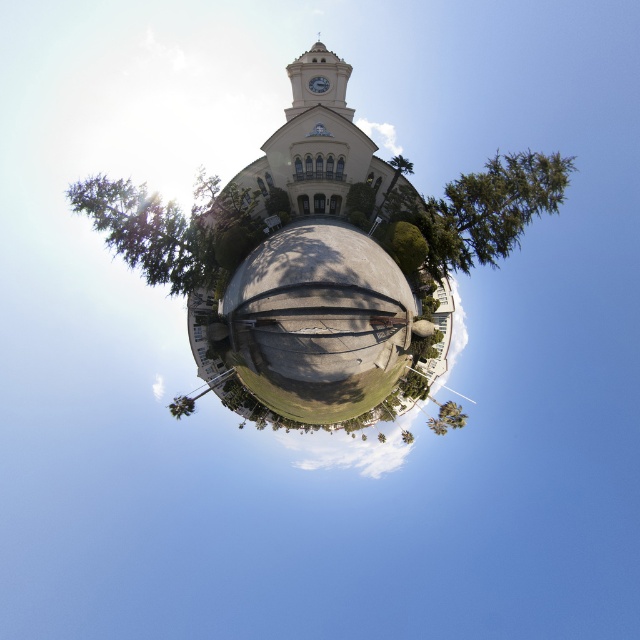
How distant is green textured tree at upper center from green leafy tree at center?

green textured tree at upper center and green leafy tree at center are 34.64 meters apart.

Which is more to the left, green textured tree at upper center or green leafy tree at center?

green leafy tree at center

In order to click on green textured tree at upper center in this screenshot , I will do (490, 209).

Who is higher up, green leafy tree at lower center or green leafy tree at center?

Positioned higher is green leafy tree at lower center.

Does green leafy tree at lower center have a lesser width compared to green leafy tree at center?

No, green leafy tree at lower center is not thinner than green leafy tree at center.

This screenshot has height=640, width=640. What are the coordinates of `green leafy tree at lower center` in the screenshot? It's located at (448, 417).

Locate an element on the screen. The width and height of the screenshot is (640, 640). green leafy tree at lower center is located at coordinates [448, 417].

Is green leafy tree at upper center shorter than green leafy tree at lower left?

No, green leafy tree at upper center is not shorter than green leafy tree at lower left.

What do you see at coordinates (172, 228) in the screenshot? I see `green leafy tree at upper center` at bounding box center [172, 228].

Find the location of a particular element. green leafy tree at upper center is located at coordinates (x=172, y=228).